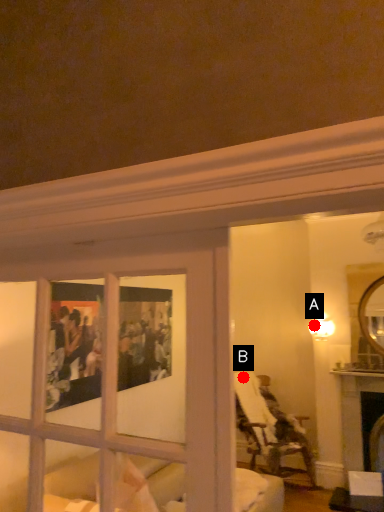
Question: Two points are circled on the image, labeled by A and B beside each circle. Among these points, which one is nearest to the camera?

Choices:
 (A) A is closer
 (B) B is closer

Answer: (A)